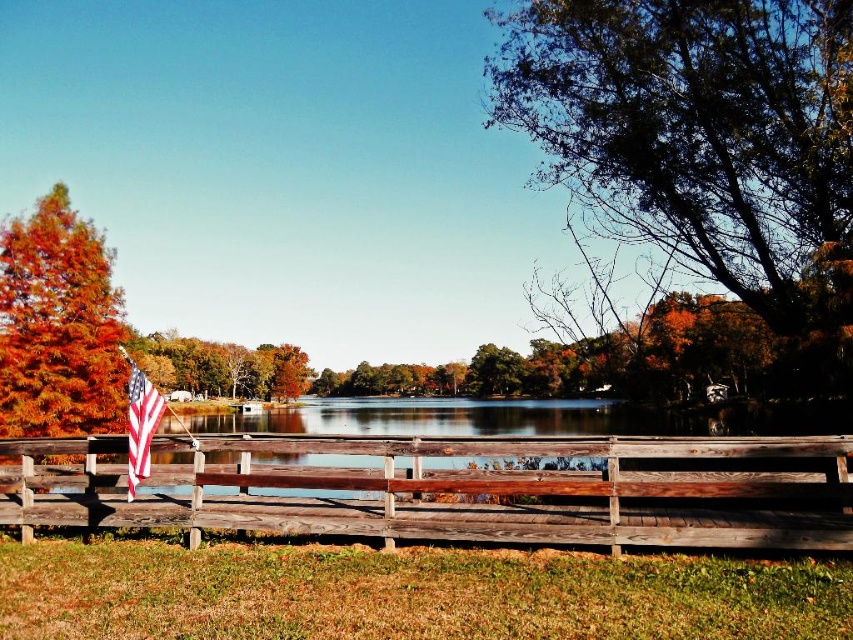
Question: Does american flag at left have a greater width compared to green leafy tree at center?

Choices:
 (A) yes
 (B) no

Answer: (A)

Question: Which of the following is the farthest from the observer?

Choices:
 (A) (132, 467)
 (B) (44, 221)

Answer: (B)

Question: Which of the following is the farthest from the observer?

Choices:
 (A) (231, 396)
 (B) (57, 344)
 (C) (262, 436)

Answer: (A)

Question: Is wooden fence at center smaller than orange autumn leaves at left?

Choices:
 (A) yes
 (B) no

Answer: (A)

Question: Can you confirm if green leafy tree at upper right is wider than american flag at left?

Choices:
 (A) no
 (B) yes

Answer: (B)

Question: Which point is farther from the camera taking this photo?

Choices:
 (A) (701, 529)
 (B) (496, 394)

Answer: (B)